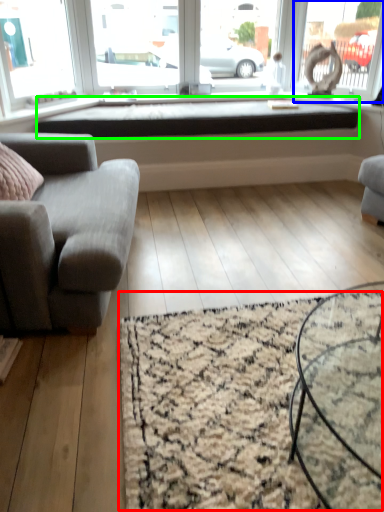
Question: Which object is the closest to the mat (highlighted by a red box)? Choose among these: window (highlighted by a blue box) or window sill (highlighted by a green box).

Choices:
 (A) window
 (B) window sill

Answer: (B)